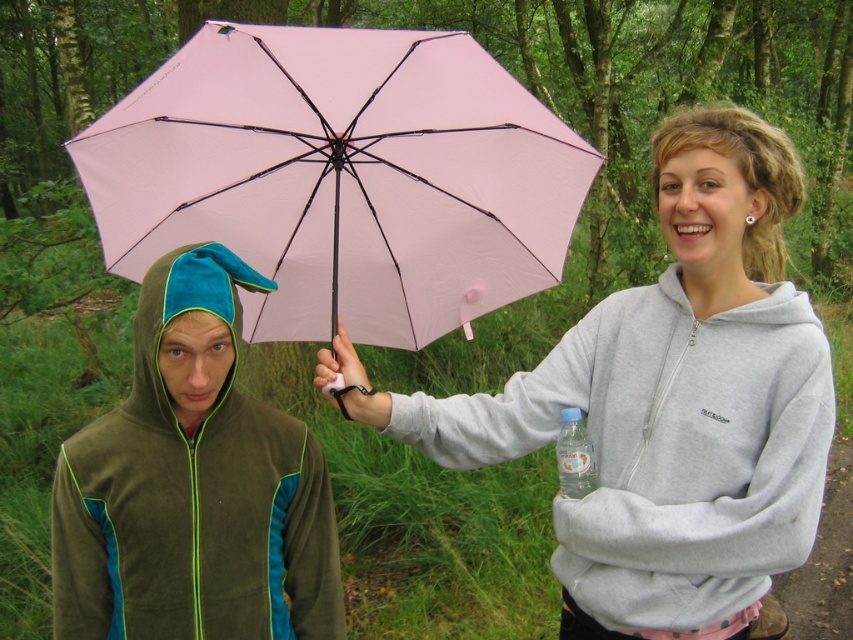
Question: Which object appears closest to the camera in this image?

Choices:
 (A) clear plastic bottle at lower center
 (B) pink matte umbrella at upper center
 (C) olive fleece jacket at left
 (D) matte pink umbrella at upper center

Answer: (D)

Question: Can you confirm if matte pink umbrella at upper center is thinner than pink matte umbrella at upper center?

Choices:
 (A) yes
 (B) no

Answer: (A)

Question: Is matte pink umbrella at upper center positioned before pink matte umbrella at upper center?

Choices:
 (A) no
 (B) yes

Answer: (B)

Question: Based on their relative distances, which object is nearer to the matte pink umbrella at upper center?

Choices:
 (A) clear plastic bottle at lower center
 (B) olive fleece jacket at left
 (C) pink matte umbrella at upper center

Answer: (A)

Question: Is olive fleece jacket at left below clear plastic bottle at lower center?

Choices:
 (A) yes
 (B) no

Answer: (A)

Question: Which of these objects is positioned closest to the clear plastic bottle at lower center?

Choices:
 (A) pink matte umbrella at upper center
 (B) olive fleece jacket at left

Answer: (B)